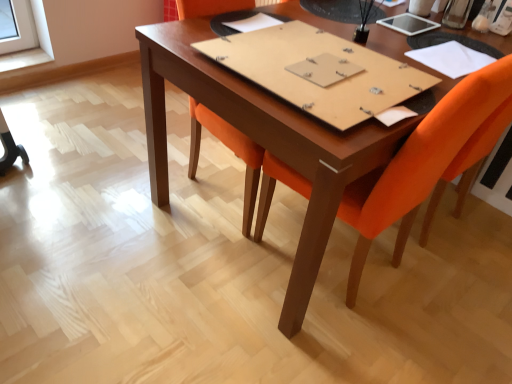
Question: From the image's perspective, is orange fabric chair at center located beneath white paper at upper right, the third notebook when ordered from left to right?

Choices:
 (A) yes
 (B) no

Answer: (A)

Question: Can you confirm if orange fabric chair at center is taller than white paper at upper right, the third notebook when ordered from left to right?

Choices:
 (A) yes
 (B) no

Answer: (A)

Question: Can you confirm if orange fabric chair at center is thinner than white paper at upper right, the third notebook when ordered from left to right?

Choices:
 (A) no
 (B) yes

Answer: (A)

Question: Considering the relative sizes of orange fabric chair at center and white paper at upper right, the third notebook when ordered from left to right, in the image provided, is orange fabric chair at center shorter than white paper at upper right, the third notebook when ordered from left to right,?

Choices:
 (A) yes
 (B) no

Answer: (B)

Question: From a real-world perspective, does orange fabric chair at center sit lower than white paper at upper right, the first notebook in the right-to-left sequence?

Choices:
 (A) yes
 (B) no

Answer: (A)

Question: Does orange fabric chair at center have a greater width compared to white paper at upper right, the third notebook when ordered from left to right?

Choices:
 (A) no
 (B) yes

Answer: (B)

Question: From a real-world perspective, is brown cardboard notebook at center, acting as the second notebook starting from the left, beneath white paper at center, which is the 1th notebook from left to right?

Choices:
 (A) no
 (B) yes

Answer: (A)

Question: From the image's perspective, is brown cardboard notebook at center, which is the 2th notebook in right-to-left order, located beneath white paper at center, the third notebook viewed from the right?

Choices:
 (A) yes
 (B) no

Answer: (A)

Question: Considering the relative sizes of brown cardboard notebook at center, acting as the second notebook starting from the left, and white paper at center, the third notebook viewed from the right, in the image provided, is brown cardboard notebook at center, acting as the second notebook starting from the left, taller than white paper at center, the third notebook viewed from the right,?

Choices:
 (A) yes
 (B) no

Answer: (A)

Question: Does brown cardboard notebook at center, which is the 2th notebook in right-to-left order, appear on the right side of white paper at center, the third notebook viewed from the right?

Choices:
 (A) yes
 (B) no

Answer: (A)

Question: Is brown cardboard notebook at center, acting as the second notebook starting from the left, closer to camera compared to white paper at center, the third notebook viewed from the right?

Choices:
 (A) no
 (B) yes

Answer: (B)

Question: Is brown cardboard notebook at center, which is the 2th notebook in right-to-left order, oriented away from white paper at center, which is the 1th notebook from left to right?

Choices:
 (A) no
 (B) yes

Answer: (A)

Question: Can you confirm if white paper at upper right, the first notebook in the right-to-left sequence, is thinner than brown cardboard notebook at center, which is the 2th notebook in right-to-left order?

Choices:
 (A) yes
 (B) no

Answer: (A)